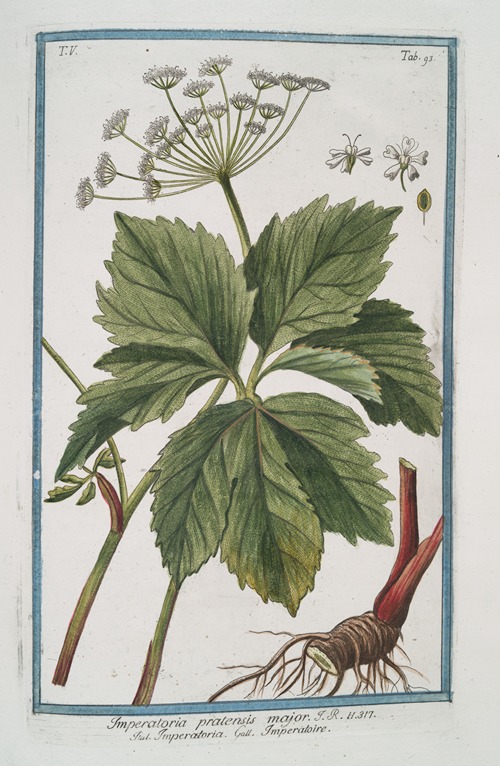
Identify the location of bulb. The height and width of the screenshot is (766, 500). (432, 548), (365, 633).